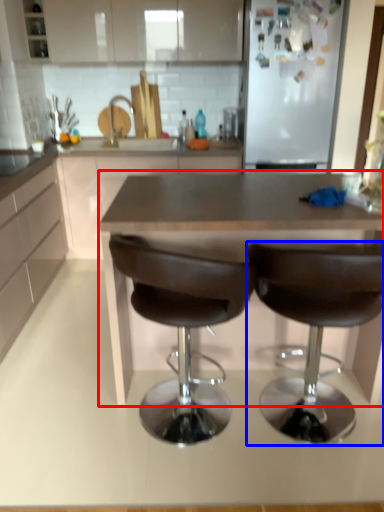
Question: Which of the following is the closest to the observer, table (highlighted by a red box) or chair (highlighted by a blue box)?

Choices:
 (A) table
 (B) chair

Answer: (B)